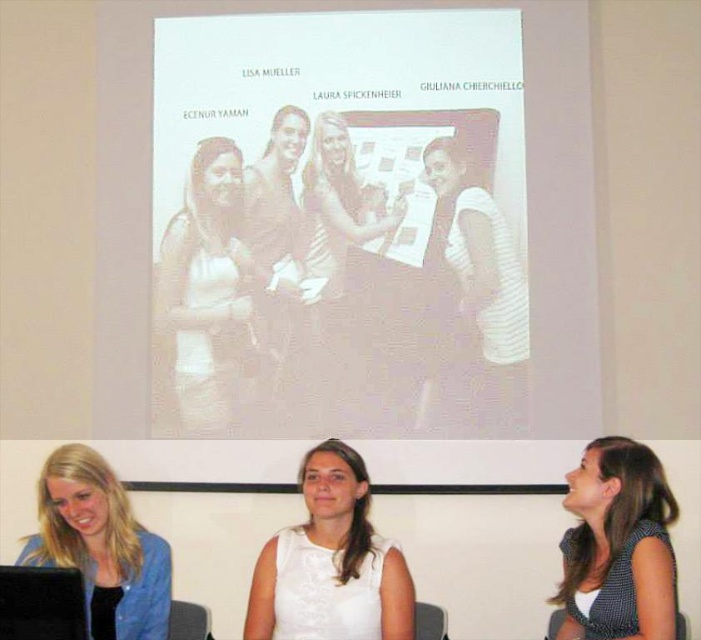
Question: Among these points, which one is farthest from the camera?

Choices:
 (A) (597, 484)
 (B) (343, 218)
 (C) (470, 403)
 (D) (271, 556)

Answer: (B)

Question: Among these points, which one is nearest to the camera?

Choices:
 (A) (625, 497)
 (B) (339, 268)

Answer: (A)

Question: Does white dotted shirt at lower right have a smaller size compared to matte blue shirt at lower left?

Choices:
 (A) no
 (B) yes

Answer: (B)

Question: Is white matte shirt at center positioned at the back of matte blue shirt at lower left?

Choices:
 (A) no
 (B) yes

Answer: (B)

Question: Considering the real-world distances, which object is closest to the matte blue shirt at lower left?

Choices:
 (A) white dotted shirt at lower right
 (B) white matte shirt at center
 (C) white fabric dress at center

Answer: (B)

Question: Can you confirm if white matte dress at center is smaller than matte blue shirt at lower left?

Choices:
 (A) yes
 (B) no

Answer: (A)